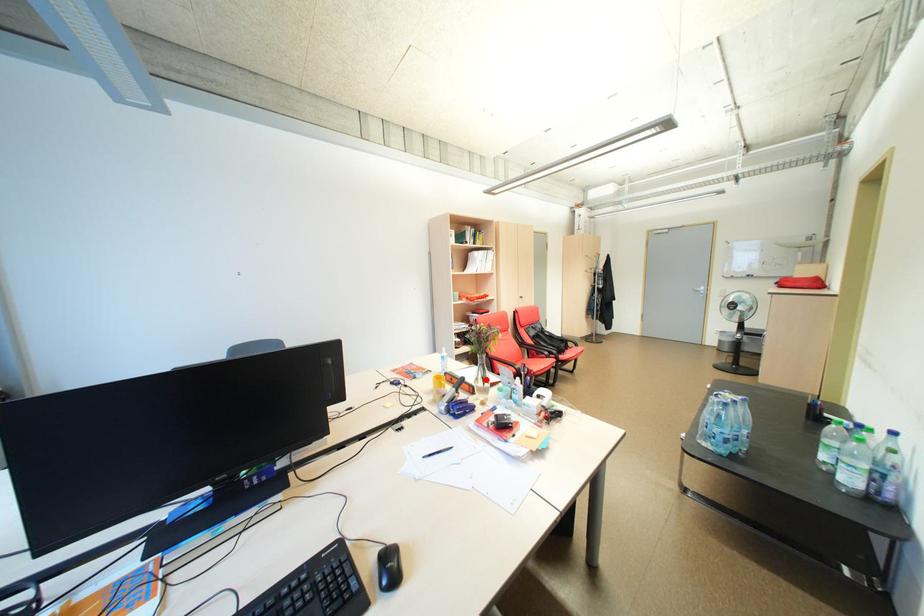
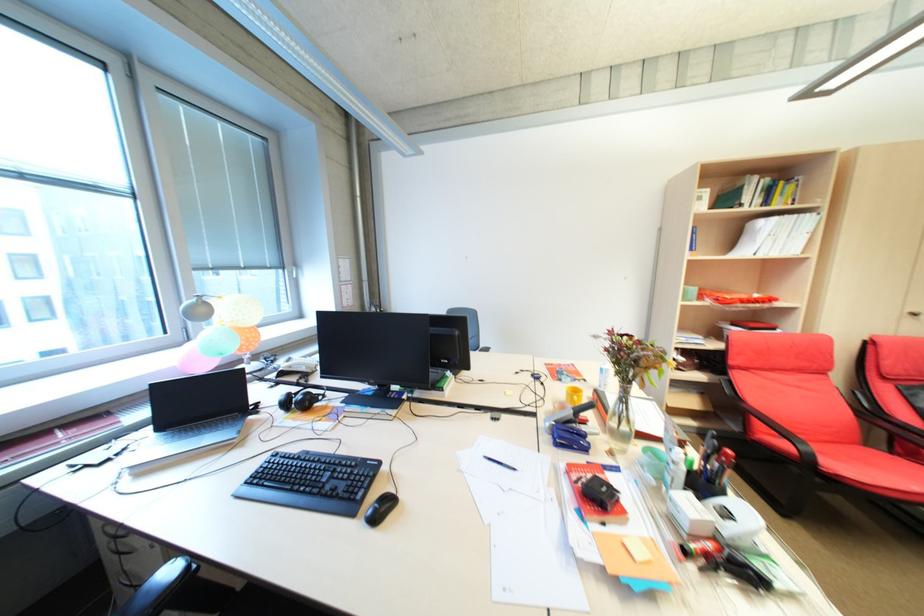
Where in the second image is the point corresponding to the highlighted location from the first image?

(623, 416)